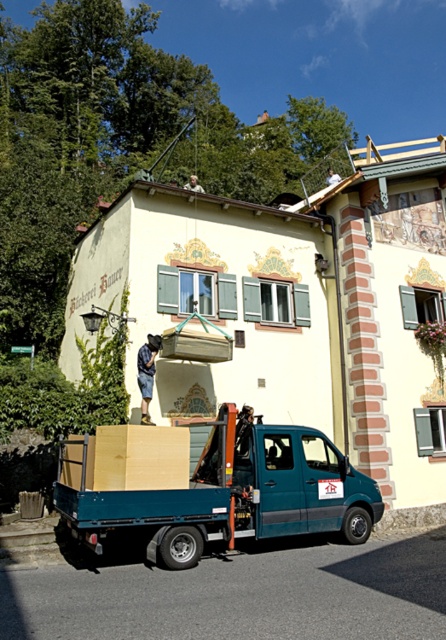
Does wooden crate at center appear on the right side of light brown cardboard at center?

Yes, wooden crate at center is to the right of light brown cardboard at center.

Which of these two, wooden crate at center or light brown cardboard at center, stands taller?

wooden crate at center is taller.

Is point (214, 515) behind point (95, 456)?

That is False.

You are a GUI agent. You are given a task and a screenshot of the screen. Output one action in this format:
    pyautogui.click(x=<x>, y=<y>)
    Task: Click on the wooden crate at center
    The height and width of the screenshot is (640, 446).
    Given the screenshot: What is the action you would take?
    pyautogui.click(x=217, y=490)